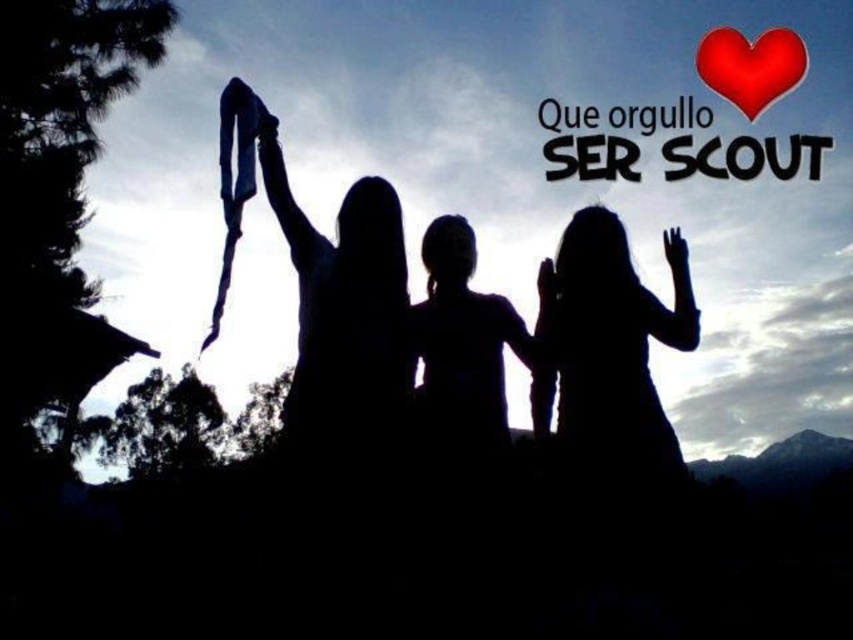
You are a photographer trying to capture the silhouette dress at center and silhouette hair at center in a single frame. Based on their positions, can you determine which object will appear lower in the photo?

The silhouette dress at center is positioned under the silhouette hair at center, so the silhouette dress at center will appear lower in the photo.

You are a photographer trying to capture a closeup of the silhouette dress at center and the red matte heart at upper right. Which object should you focus on first to ensure both are in focus without adjusting the camera settings?

The silhouette dress at center is closer to the viewer than the red matte heart at upper right. To keep both in focus, focus on the silhouette dress at center first since it is closer, and the red matte heart at upper right will naturally fall into focus if the depth of field is sufficient.